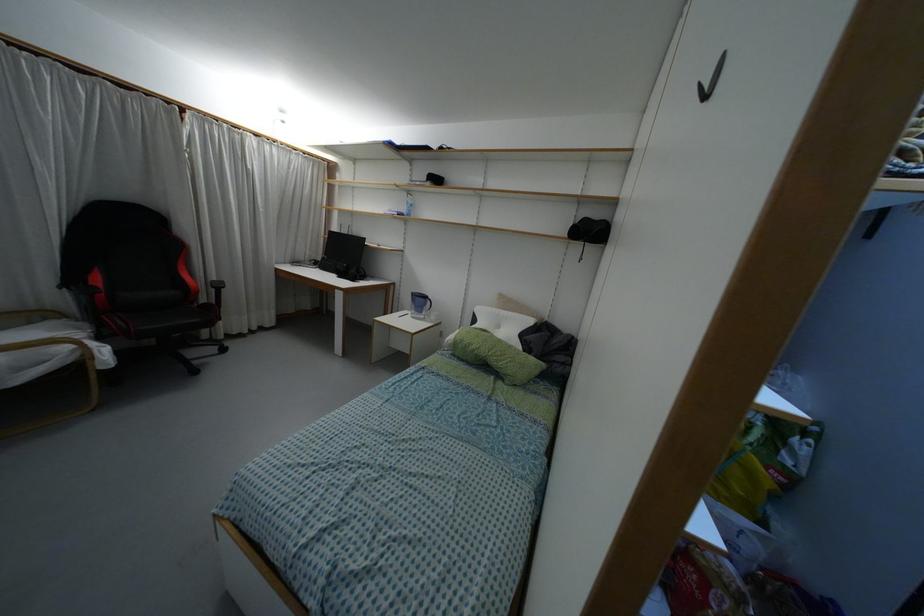
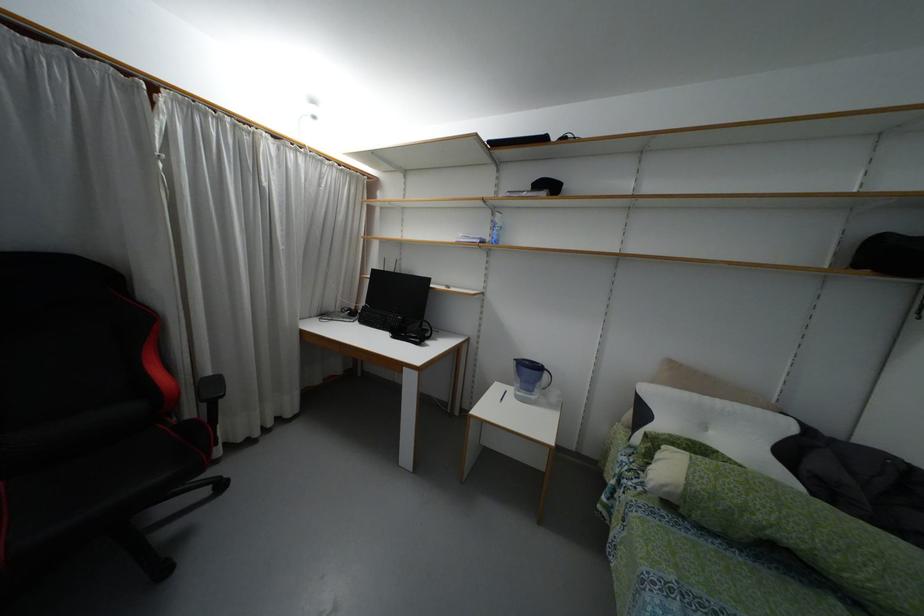
The point at (407, 192) is marked in the first image. Where is the corresponding point in the second image?

(493, 209)